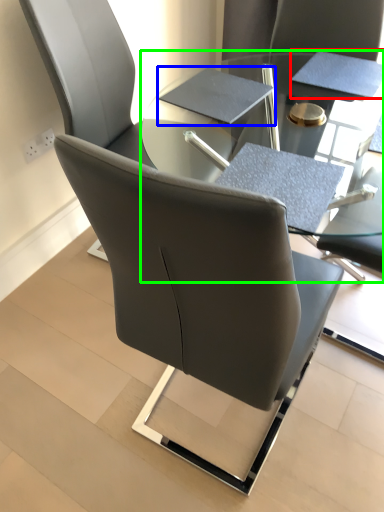
Question: Estimate the real-world distances between objects in this image. Which object is farther from notepad (highlighted by a red box), notebook (highlighted by a blue box) or table (highlighted by a green box)?

Choices:
 (A) notebook
 (B) table

Answer: (A)